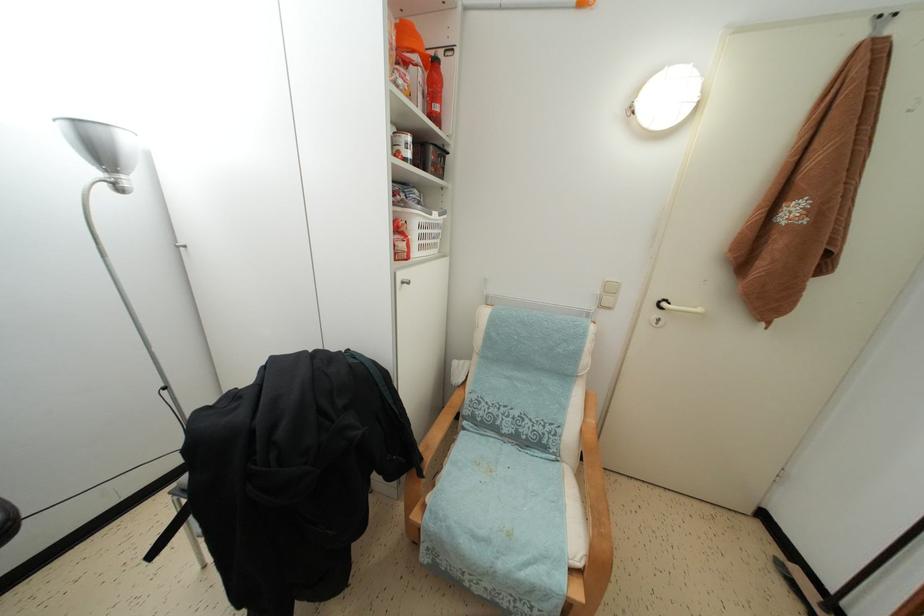
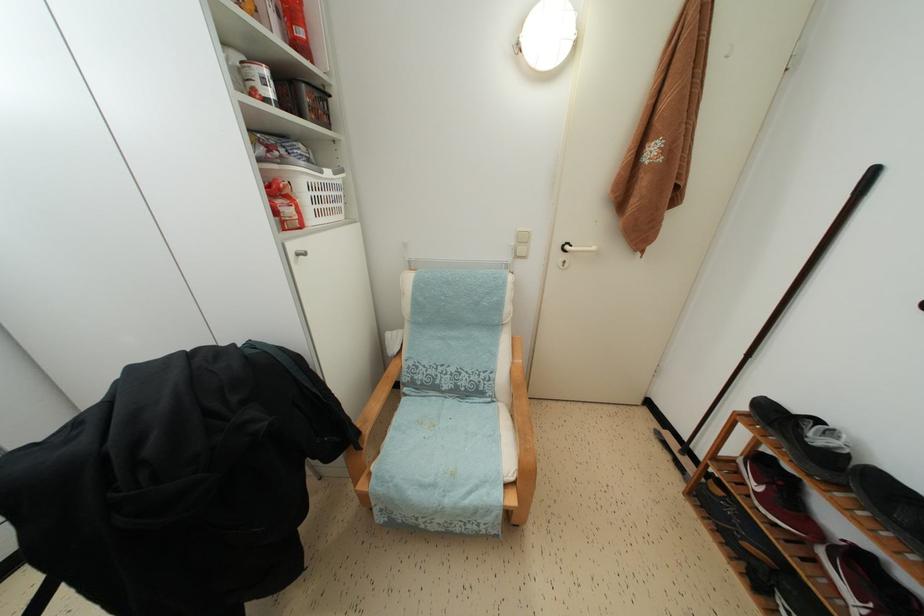
In the second image, find the point that corresponds to (x=441, y=113) in the first image.

(305, 38)